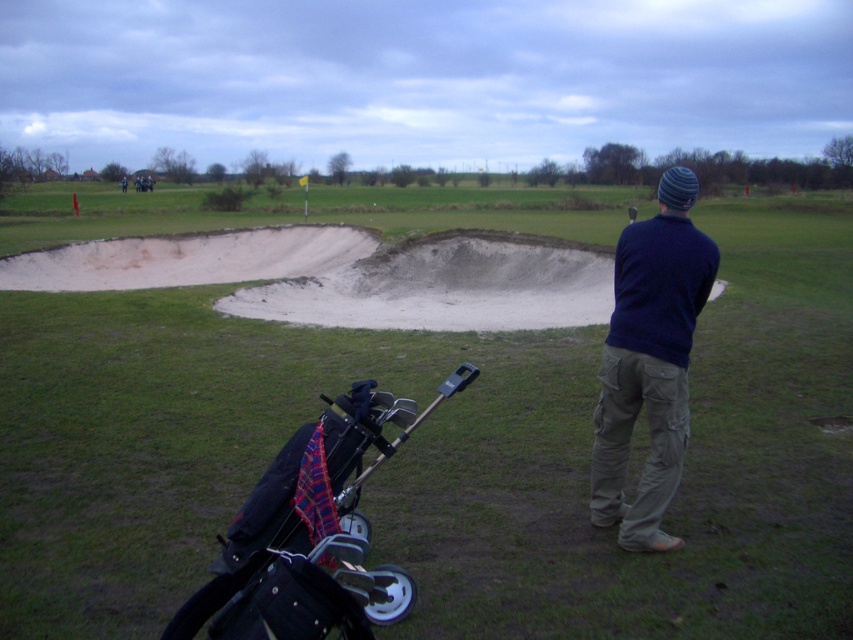
You are standing at the point marked as point (154, 524) on the golf course. The golfer is preparing to hit a ball towards the hole located 4.60 meters away from you. Can the golfer reach the hole with a 5 iron club that has a maximum distance of 180 yards?

The distance between the golfer and the hole is 4.60 meters. Since 180 yards is approximately 164.59 meters, the 5 iron club can easily reach the hole as 164.59 meters is much greater than 4.60 meters.